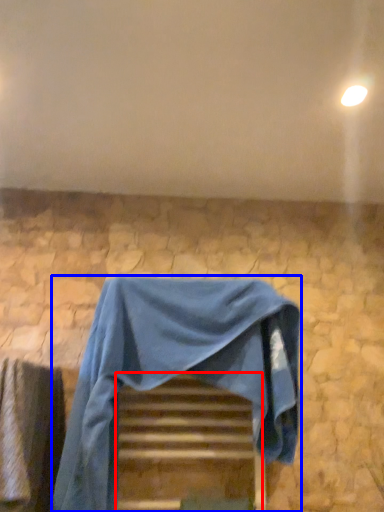
Question: Which object is further to the camera taking this photo, stairwell (highlighted by a red box) or furniture (highlighted by a blue box)?

Choices:
 (A) stairwell
 (B) furniture

Answer: (A)